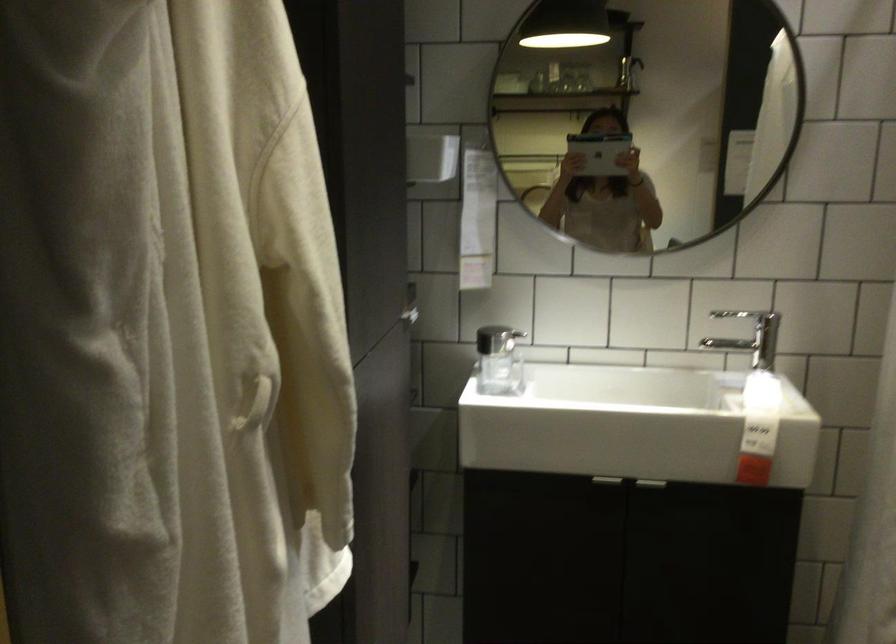
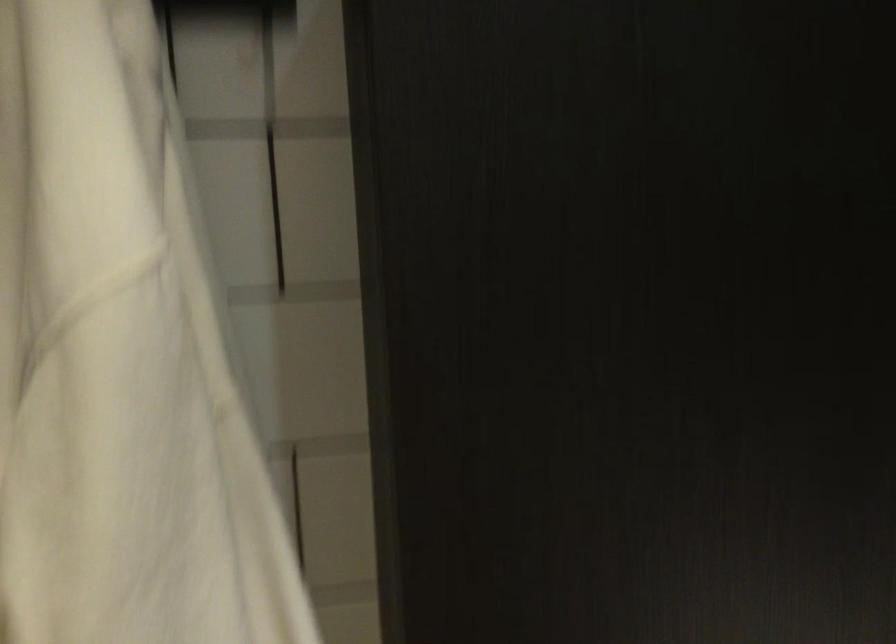
Question: Based on the continuous images, in which direction is the camera rotating? Reply with the corresponding letter.

Choices:
 (A) Left
 (B) Right
 (C) Up
 (D) Down

Answer: (A)